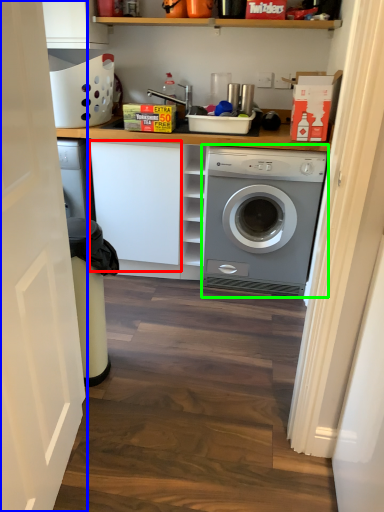
Question: Considering the real-world distances, which object is farthest from cabinetry (highlighted by a red box)? door (highlighted by a blue box) or washing machine (highlighted by a green box)?

Choices:
 (A) door
 (B) washing machine

Answer: (A)